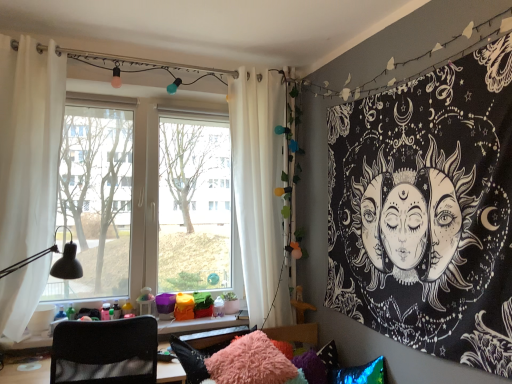
Identify the location of empty space that is ontop of black paper tapestry at upper right (from a real-world perspective). This screenshot has height=384, width=512. (395, 75).